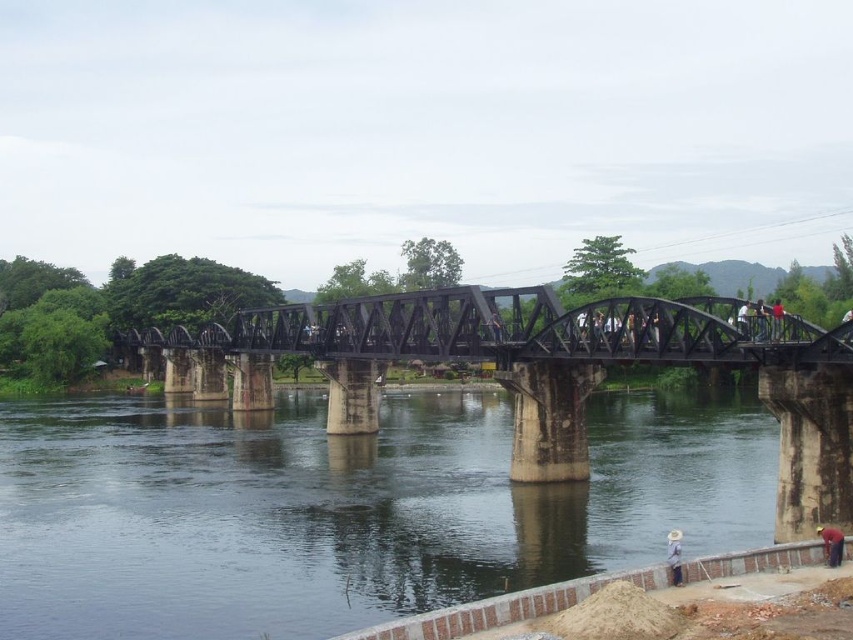
Question: Which object is positioned farthest from the gray fabric hat at lower right?

Choices:
 (A) red shirt at center
 (B) red matte shirt at lower right
 (C) black metal bridge at center
 (D) light blue shirt at upper right

Answer: (C)

Question: Which is nearer to the black metal bridge at center?

Choices:
 (A) red matte shirt at lower right
 (B) clear water at bridge lower
 (C) gray fabric hat at lower right

Answer: (B)

Question: Is clear water at bridge lower to the left of red shirt at center from the viewer's perspective?

Choices:
 (A) yes
 (B) no

Answer: (A)

Question: Considering the relative positions of red matte shirt at lower right and light blue shirt at upper right in the image provided, where is red matte shirt at lower right located with respect to light blue shirt at upper right?

Choices:
 (A) right
 (B) left

Answer: (A)

Question: Can you confirm if red matte shirt at lower right is positioned to the left of red shirt at center?

Choices:
 (A) yes
 (B) no

Answer: (A)

Question: Which of the following is the closest to the observer?

Choices:
 (A) clear water at bridge lower
 (B) red shirt at center

Answer: (A)